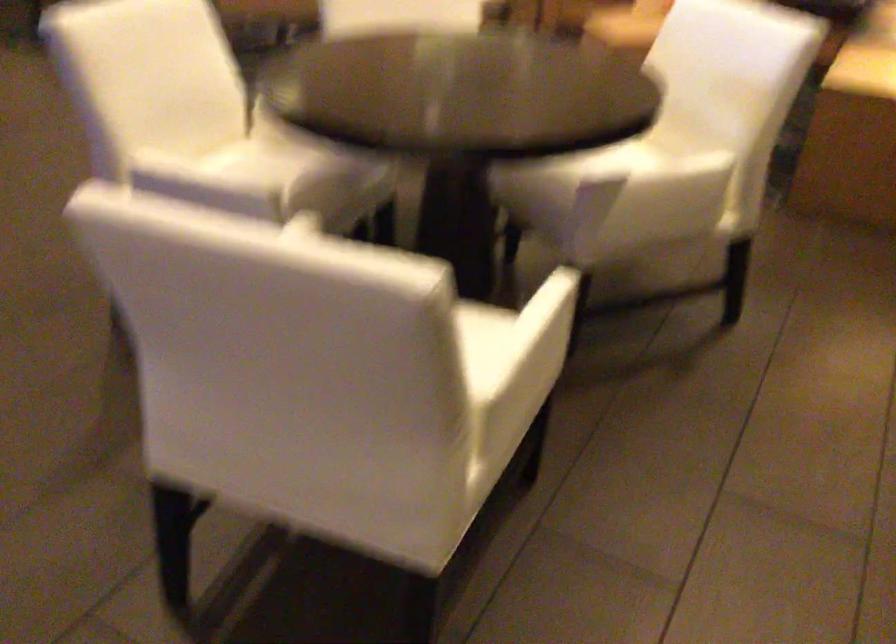
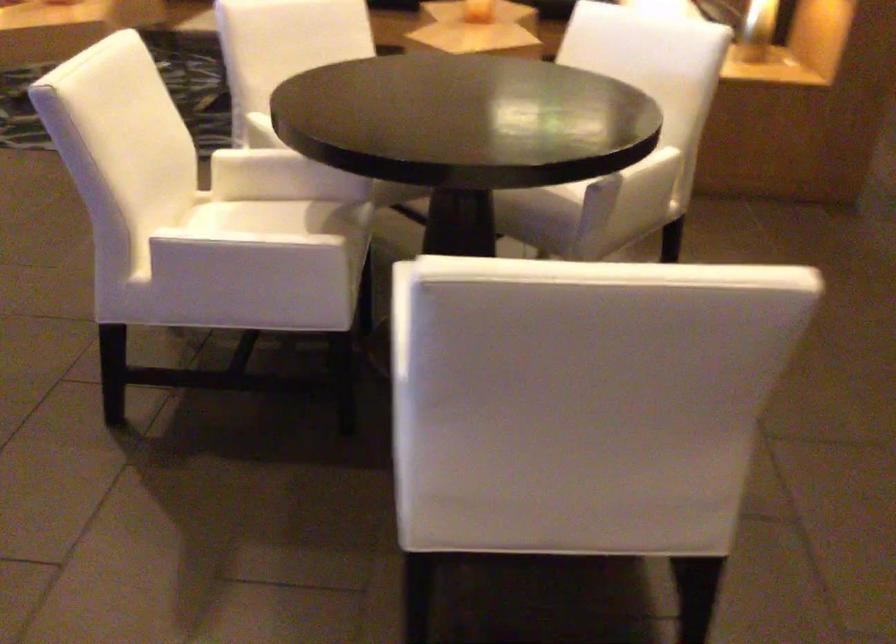
Question: The first image is from the beginning of the video and the second image is from the end. How did the camera likely rotate when shooting the video?

Choices:
 (A) Left
 (B) Right
 (C) Up
 (D) Down

Answer: (B)